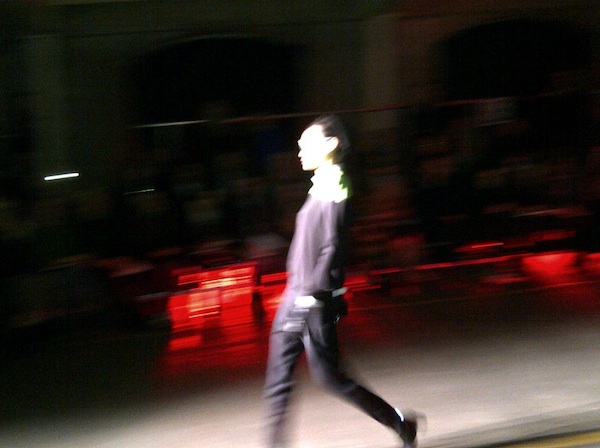
Identify the location of doorway. The height and width of the screenshot is (448, 600). (177, 50).